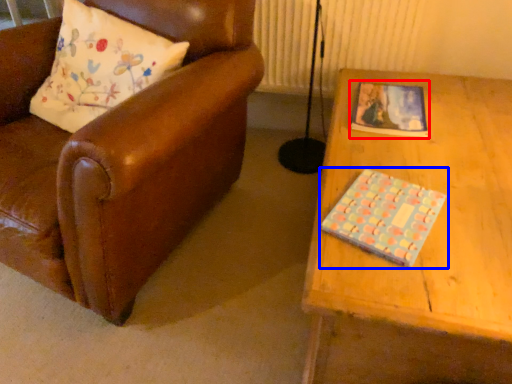
Question: Which object appears farthest to the camera in this image, book (highlighted by a red box) or book (highlighted by a blue box)?

Choices:
 (A) book
 (B) book

Answer: (A)